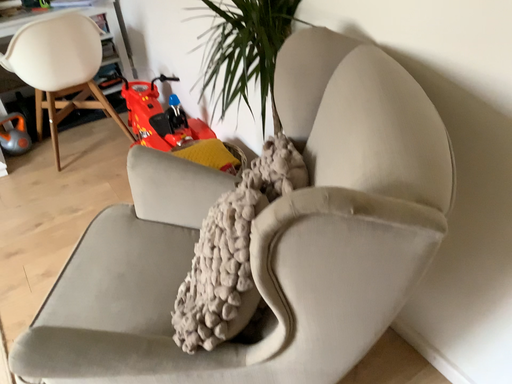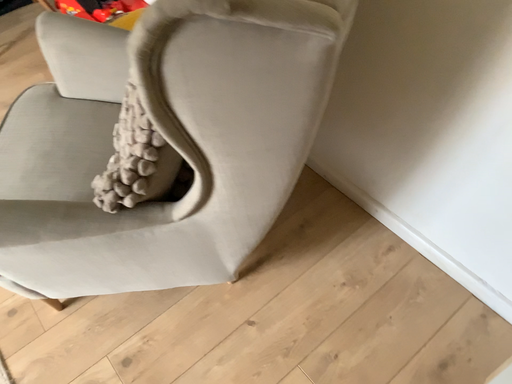
Question: How did the camera likely rotate when shooting the video?

Choices:
 (A) rotated downward
 (B) rotated upward

Answer: (A)